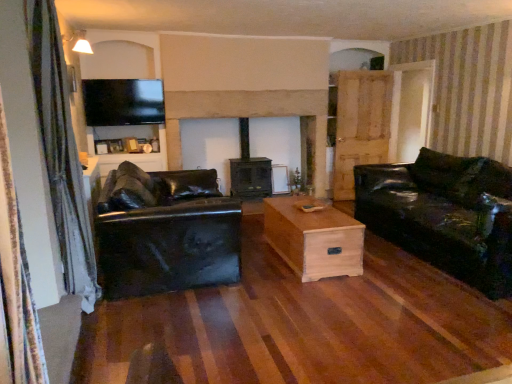
The image size is (512, 384). What are the coordinates of `vacant area that is situated to the right of light wood/texture coffee table at center` in the screenshot? It's located at (398, 270).